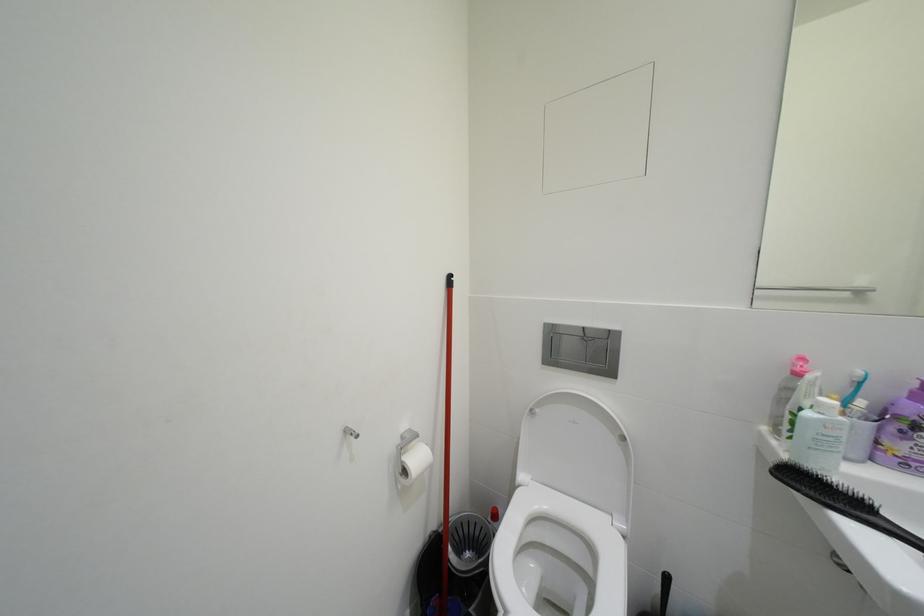
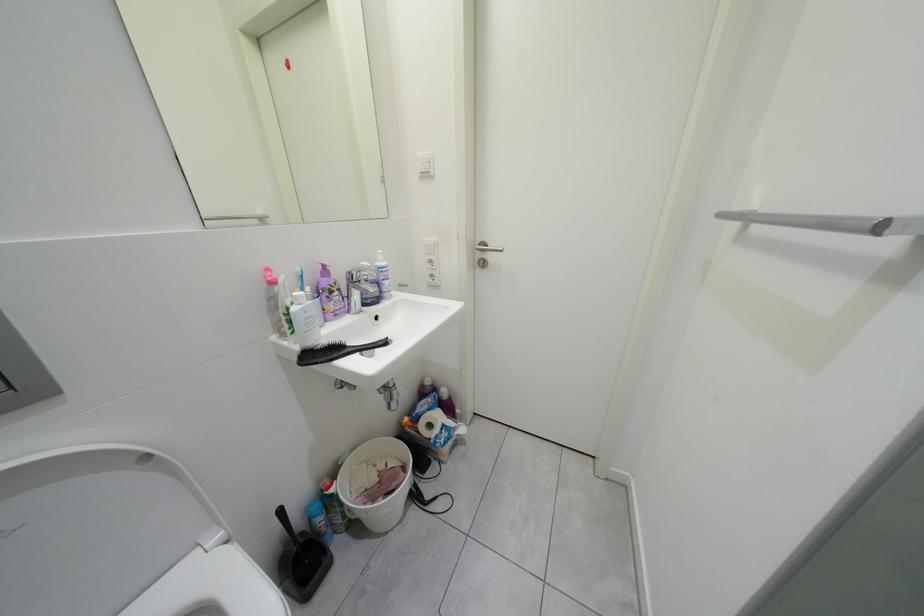
The images are taken continuously from a first-person perspective. In which direction is your viewpoint rotating?

The rotation direction of the camera is right-down.